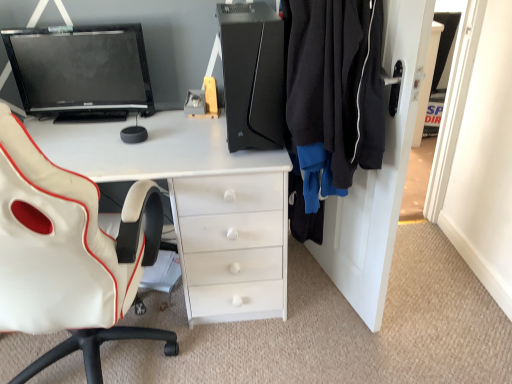
Question: Can you confirm if white leather chair at left is taller than black matte computer tower at center?

Choices:
 (A) no
 (B) yes

Answer: (B)

Question: Is white leather chair at left not within black matte computer tower at center?

Choices:
 (A) yes
 (B) no

Answer: (A)

Question: From a real-world perspective, is white leather chair at left positioned over black matte computer tower at center based on gravity?

Choices:
 (A) no
 (B) yes

Answer: (A)

Question: From the image's perspective, does white leather chair at left appear lower than black matte computer tower at center?

Choices:
 (A) yes
 (B) no

Answer: (A)

Question: Is white leather chair at left aimed at black matte computer tower at center?

Choices:
 (A) yes
 (B) no

Answer: (B)

Question: Can you confirm if white leather chair at left is wider than black matte computer tower at center?

Choices:
 (A) no
 (B) yes

Answer: (B)

Question: Is black fleece jacket at right wider than matte black monitor at upper left?

Choices:
 (A) yes
 (B) no

Answer: (A)

Question: Is black fleece jacket at right looking in the opposite direction of matte black monitor at upper left?

Choices:
 (A) yes
 (B) no

Answer: (B)

Question: Can we say black fleece jacket at right lies outside matte black monitor at upper left?

Choices:
 (A) no
 (B) yes

Answer: (B)

Question: From the image's perspective, is black fleece jacket at right on matte black monitor at upper left?

Choices:
 (A) no
 (B) yes

Answer: (A)

Question: Is black fleece jacket at right far away from matte black monitor at upper left?

Choices:
 (A) yes
 (B) no

Answer: (B)

Question: Can you confirm if black fleece jacket at right is thinner than matte black monitor at upper left?

Choices:
 (A) yes
 (B) no

Answer: (B)

Question: Does white leather chair at left have a smaller size compared to matte black monitor at upper left?

Choices:
 (A) yes
 (B) no

Answer: (B)